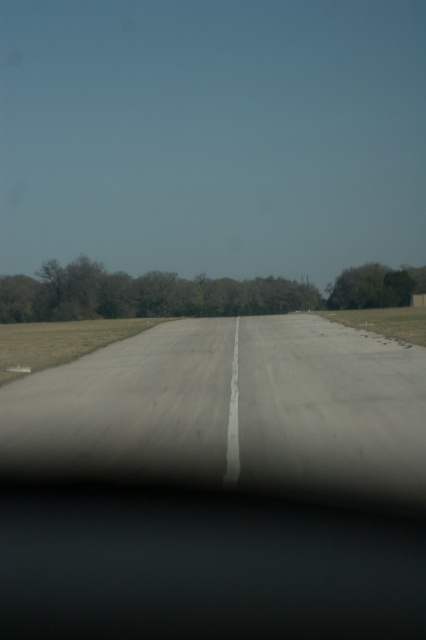
You are a drone operator planning to fly a drone from the gray asphalt runway at center to the green leafy trees at center. Based on the scene, which direction should you fly the drone to reach the trees?

The gray asphalt runway at center is closer to the viewer than the green leafy trees at center, so you should fly the drone away from the viewer towards the trees to reach them.

You are a pilot preparing to land a small airplane. You notice the gray asphalt runway at center and the green leafy tree at right in your view. Which object is closer to your current position?

The gray asphalt runway at center is closer to your current position because it is located below the green leafy tree at right, indicating it is nearer in the visual perspective.

You are standing at the starting point of the road and want to reach the green leafy trees at center. Which direction should you walk to get there?

The green leafy trees at center are located at point [190,292] in the image, so you should walk forward along the road towards the center of the image to reach them.